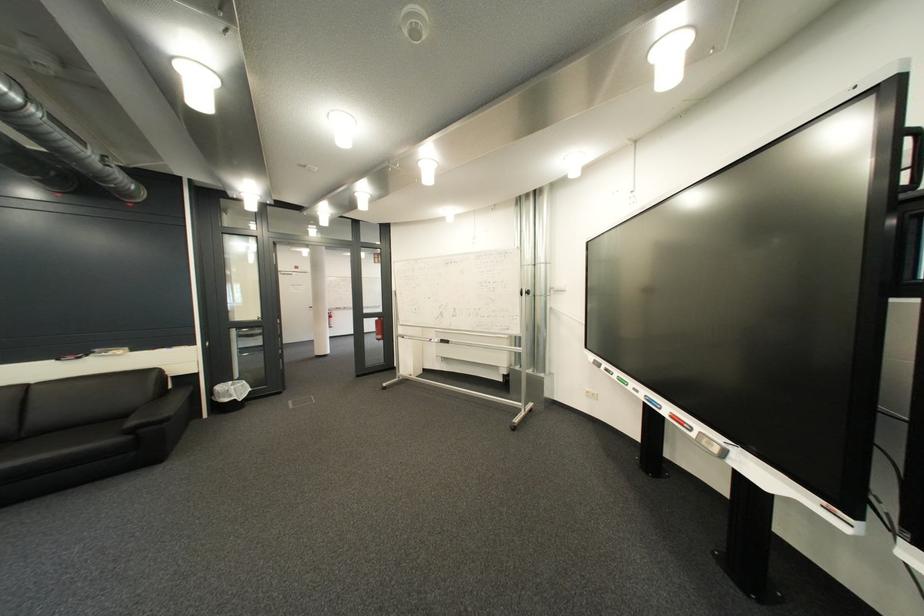
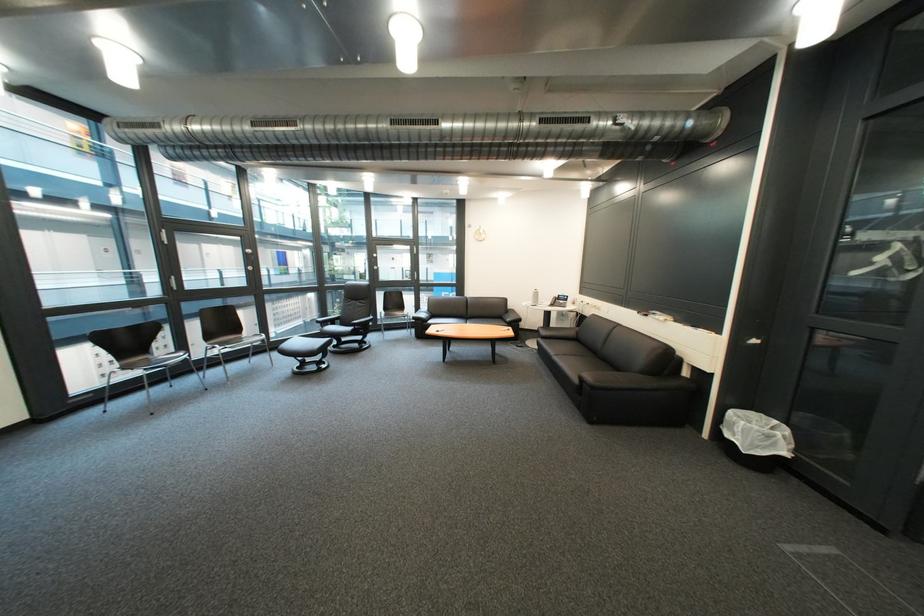
Where in the second image is the point corresponding to (246,392) from the first image?

(751, 431)